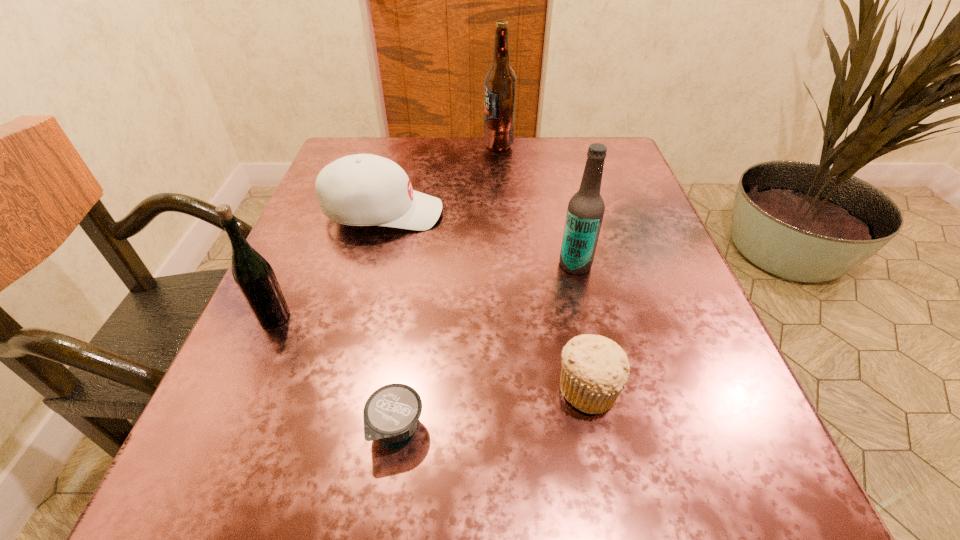
At what (x,y) coordinates should I click in order to perform the action: click on object that is at the far edge. Please return your answer as a coordinate pair (x, y). The image size is (960, 540). Looking at the image, I should click on (500, 80).

Identify the location of object that is at the near edge. This screenshot has width=960, height=540. (392, 412).

This screenshot has width=960, height=540. I want to click on beer bottle at the left edge, so click(254, 276).

Where is `baseball cap present at the left edge`? baseball cap present at the left edge is located at coordinates (363, 189).

The height and width of the screenshot is (540, 960). I want to click on beer bottle located in the right edge section of the desktop, so click(x=585, y=212).

Find the location of a particular element. The height and width of the screenshot is (540, 960). muffin that is at the right edge is located at coordinates (595, 369).

Find the location of a particular element. The width and height of the screenshot is (960, 540). vacant space at the far edge of the desktop is located at coordinates (492, 179).

Locate an element on the screen. The image size is (960, 540). vacant space at the near edge is located at coordinates (452, 526).

The image size is (960, 540). In the image, there is a desktop. What are the coordinates of `vacant space at the left edge` in the screenshot? It's located at (276, 431).

Locate an element on the screen. Image resolution: width=960 pixels, height=540 pixels. free region at the right edge of the desktop is located at coordinates (625, 215).